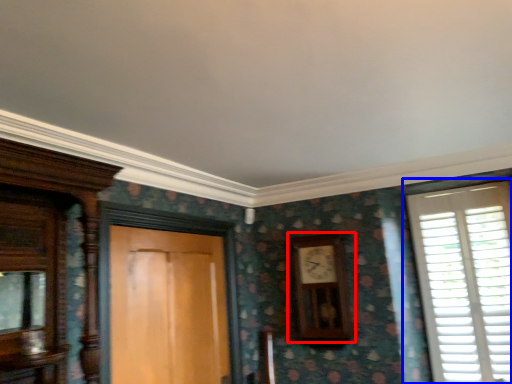
Question: Which object appears closest to the camera in this image, clock (highlighted by a red box) or window (highlighted by a blue box)?

Choices:
 (A) clock
 (B) window

Answer: (B)